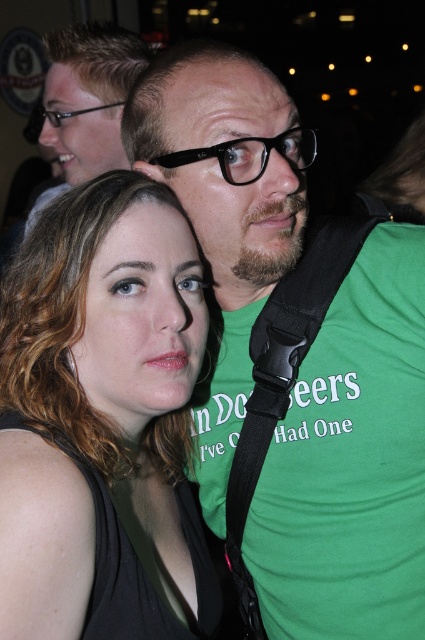
Question: Can you confirm if black fabric strap at center is positioned to the left of black plastic glasses at center?

Choices:
 (A) yes
 (B) no

Answer: (B)

Question: Does matte black glasses at upper left appear on the right side of black plastic glasses at upper center?

Choices:
 (A) no
 (B) yes

Answer: (B)

Question: Among these objects, which one is farthest from the camera?

Choices:
 (A) black plastic glasses at upper center
 (B) matte black tank top at center
 (C) black fabric strap at center

Answer: (A)

Question: Can you confirm if matte black glasses at upper left is positioned to the right of black plastic glasses at upper center?

Choices:
 (A) yes
 (B) no

Answer: (A)

Question: Which point is farther to the camera?

Choices:
 (A) (337, 305)
 (B) (56, 118)
 (C) (61, 124)

Answer: (C)

Question: Which point is farther from the camera taking this photo?

Choices:
 (A) (70, 115)
 (B) (217, 144)

Answer: (A)